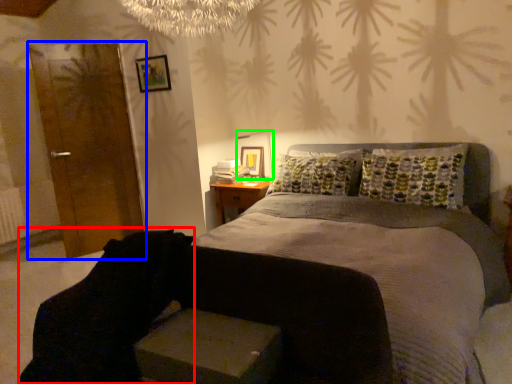
Question: Which object is positioned farthest from swivel chair (highlighted by a red box)? Select from armoire (highlighted by a blue box) and table lamp (highlighted by a green box).

Choices:
 (A) armoire
 (B) table lamp

Answer: (A)